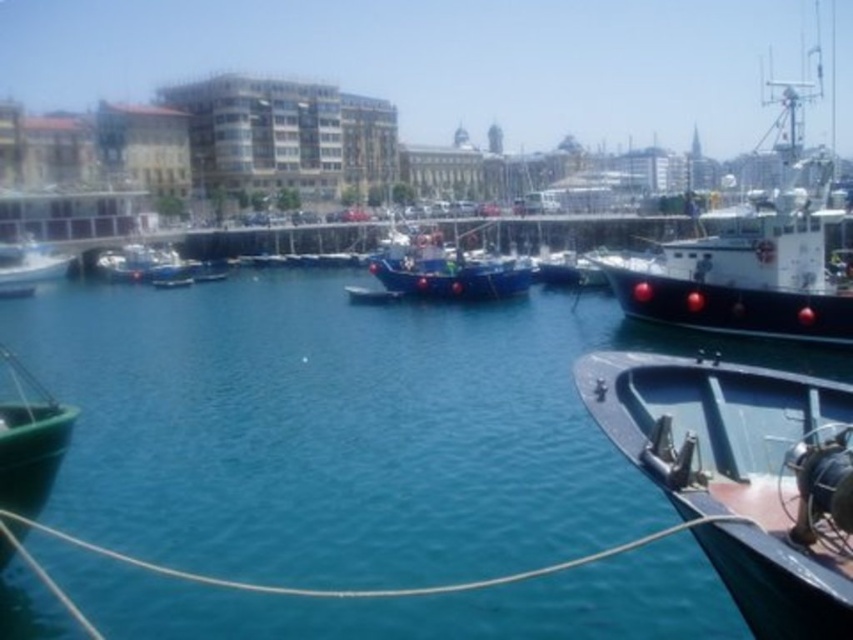
You are a harbor worker who needs to secure both the green matte boat at lower left and the blue matte boat at center. Since you can only move along the pier, which boat should you secure first if you start from the top of the pier?

The green matte boat at lower left should be secured first because it is located below the blue matte boat at center, meaning it is closer to the bottom of the pier and thus reachable first when starting from the top.

You are standing at the pier and looking out at the harbor. There are two points marked in the image, one at coordinates point (x=56, y=262) and another at point (x=375, y=301). Which point is closer to you?

Point (x=375, y=301) is closer to you because it is in front of point (x=56, y=262), which is behind it.